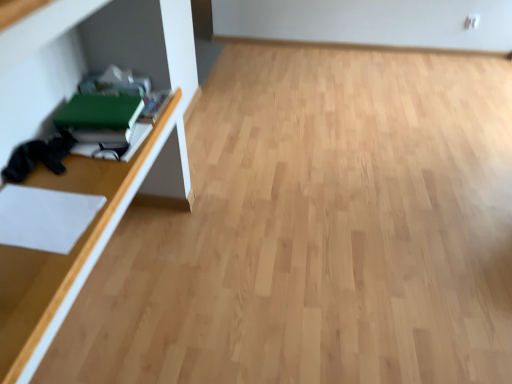
Measure the distance between wooden at left and camera.

wooden at left is 80.15 centimeters from camera.

This screenshot has height=384, width=512. What do you see at coordinates (128, 163) in the screenshot?
I see `wooden at left` at bounding box center [128, 163].

In order to click on wooden at left in this screenshot , I will do `click(128, 163)`.

Locate an element on the screen. The height and width of the screenshot is (384, 512). wooden at left is located at coordinates (128, 163).